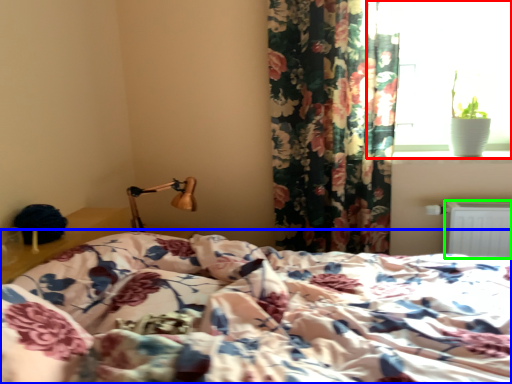
Question: Which object is the closest to the window (highlighted by a red box)? Choose among these: bed (highlighted by a blue box) or radiator (highlighted by a green box).

Choices:
 (A) bed
 (B) radiator

Answer: (B)